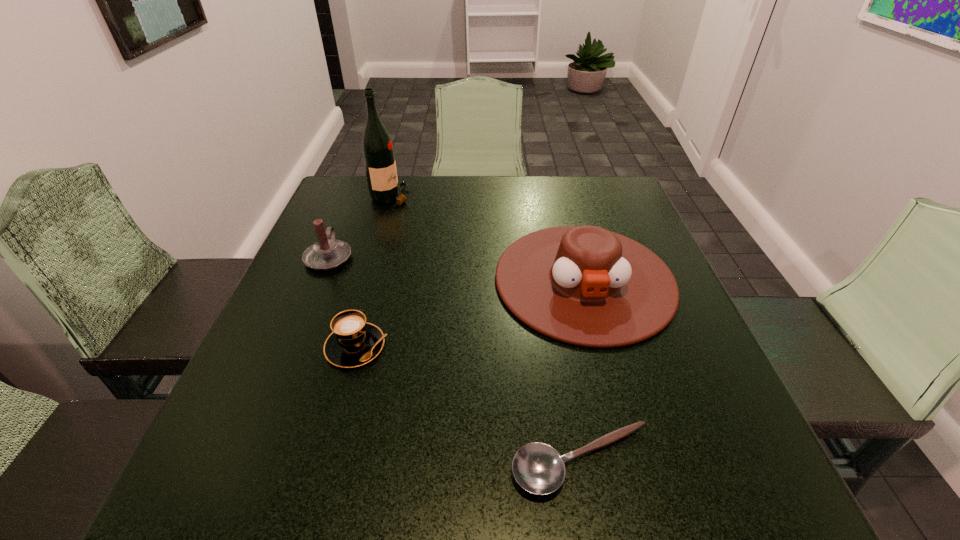
You are a GUI agent. You are given a task and a screenshot of the screen. Output one action in this format:
    pyautogui.click(x=<x>, y=<y>)
    Task: Click on the free spot between the farthest object and the ladle
    The image size is (960, 540).
    Given the screenshot: What is the action you would take?
    pyautogui.click(x=487, y=328)

Find the location of `vacant area that lies between the second shortest object and the tallest object`. vacant area that lies between the second shortest object and the tallest object is located at coordinates (373, 272).

Image resolution: width=960 pixels, height=540 pixels. I want to click on vacant area that lies between the candle and the cowboy hat, so click(x=457, y=268).

What are the coordinates of `unoccupied area between the candle and the tallest object` in the screenshot? It's located at (360, 226).

Where is `unoccupied position between the nearest object and the cowboy hat`? unoccupied position between the nearest object and the cowboy hat is located at coordinates (584, 370).

Locate an element on the screen. vacant space in between the cowboy hat and the candle is located at coordinates (457, 268).

You are a GUI agent. You are given a task and a screenshot of the screen. Output one action in this format:
    pyautogui.click(x=<x>, y=<y>)
    Task: Click on the free space between the candle and the nearest object
    
    Given the screenshot: What is the action you would take?
    pyautogui.click(x=456, y=359)

Select which object appears as the third closest to the candle. Please provide its 2D coordinates. Your answer should be formatted as a tuple, i.e. [(x, y)], where the tuple contains the x and y coordinates of a point satisfying the conditions above.

[(584, 285)]

The image size is (960, 540). In order to click on the second closest object to the cowboy hat in this screenshot , I will do click(354, 342).

What are the coordinates of `free region that satisfies the following two spatial constraints: 1. on the surface of the wine bottle; 2. on the left side of the second shortest object` in the screenshot? It's located at pos(348,347).